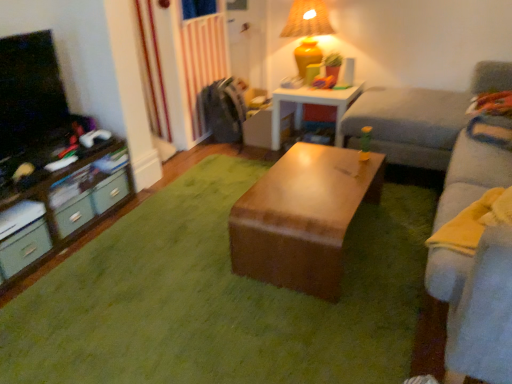
The image size is (512, 384). What are the coordinates of `gray fabric couch at center` in the screenshot? It's located at (420, 118).

Identify the location of matte yellow ceramic table lamp at upper right. The height and width of the screenshot is (384, 512). (307, 31).

Image resolution: width=512 pixels, height=384 pixels. What do you see at coordinates (472, 173) in the screenshot?
I see `light gray fabric couch at right` at bounding box center [472, 173].

You are a GUI agent. You are given a task and a screenshot of the screen. Output one action in this format:
    pyautogui.click(x=<x>, y=<y>)
    Task: Click on the wooden table at center, the second table positioned from the bottom
    This screenshot has height=384, width=512.
    Given the screenshot: What is the action you would take?
    pyautogui.click(x=311, y=103)

From a real-world perspective, which object stands above the other?

matte yellow ceramic table lamp at upper right is physically above.

How different are the orientations of matte gray drawer at lower left, the third drawer in the back-to-front sequence, and matte yellow ceramic table lamp at upper right in degrees?

91.7 degrees separate the facing orientations of matte gray drawer at lower left, the third drawer in the back-to-front sequence, and matte yellow ceramic table lamp at upper right.

Locate an element on the screen. This screenshot has height=384, width=512. drawer that is the 3rd one when counting leftward from the matte yellow ceramic table lamp at upper right is located at coordinates (24, 248).

How many degrees apart are the facing directions of matte gray drawer at lower left, placed as the first drawer when sorted from front to back, and matte black desk at left?

The angular difference between matte gray drawer at lower left, placed as the first drawer when sorted from front to back, and matte black desk at left is 0.000595 degrees.

Based on their sizes in the image, would you say matte gray drawer at lower left, placed as the first drawer when sorted from front to back, is bigger or smaller than matte black desk at left?

matte gray drawer at lower left, placed as the first drawer when sorted from front to back, is smaller than matte black desk at left.

Could you tell me if matte gray drawer at lower left, the third drawer in the back-to-front sequence, is turned towards matte black desk at left?

Yes, matte gray drawer at lower left, the third drawer in the back-to-front sequence, is aimed at matte black desk at left.

Does matte gray drawer at lower left, placed as the first drawer when sorted from front to back, have a greater height compared to matte black desk at left?

No, matte gray drawer at lower left, placed as the first drawer when sorted from front to back, is not taller than matte black desk at left.

Is wooden table at center, the 2th table from the front, situated inside matte gray drawer at lower left, the third drawer in the back-to-front sequence, or outside?

wooden table at center, the 2th table from the front, is located beyond the bounds of matte gray drawer at lower left, the third drawer in the back-to-front sequence.

Considering the relative sizes of wooden table at center, the 2th table from the front, and matte gray drawer at lower left, the third drawer in the back-to-front sequence, in the image provided, is wooden table at center, the 2th table from the front, bigger than matte gray drawer at lower left, the third drawer in the back-to-front sequence,?

Correct, wooden table at center, the 2th table from the front, is larger in size than matte gray drawer at lower left, the third drawer in the back-to-front sequence.

Is wooden table at center, the 2th table from the front, oriented towards matte gray drawer at lower left, the third drawer in the back-to-front sequence?

Yes.

Considering the relative positions of wooden table at center, which ranks as the 1th table in back-to-front order, and matte gray drawer at lower left, placed as the first drawer when sorted from front to back, in the image provided, is wooden table at center, which ranks as the 1th table in back-to-front order, to the right of matte gray drawer at lower left, placed as the first drawer when sorted from front to back, from the viewer's perspective?

Correct, you'll find wooden table at center, which ranks as the 1th table in back-to-front order, to the right of matte gray drawer at lower left, placed as the first drawer when sorted from front to back.

Is green plastic drawer at left, acting as the 1th drawer starting from the back, positioned far away from wooden table at center, the 2th table from the front?

Indeed, green plastic drawer at left, acting as the 1th drawer starting from the back, is not near wooden table at center, the 2th table from the front.

Considering the sizes of objects green plastic drawer at left, which ranks as the third drawer in front-to-back order, and wooden table at center, the 2th table from the front, in the image provided, who is taller, green plastic drawer at left, which ranks as the third drawer in front-to-back order, or wooden table at center, the 2th table from the front,?

Standing taller between the two is wooden table at center, the 2th table from the front.

Considering the relative sizes of green plastic drawer at left, which ranks as the third drawer in front-to-back order, and wooden table at center, which ranks as the 1th table in back-to-front order, in the image provided, is green plastic drawer at left, which ranks as the third drawer in front-to-back order, smaller than wooden table at center, which ranks as the 1th table in back-to-front order,?

Yes.

Does point (110, 191) appear closer or farther from the camera than point (280, 141)?

Point (110, 191) appears to be closer to the viewer than point (280, 141).

Based on their sizes in the image, would you say light gray fabric couch at right is bigger or smaller than green matte drawer at left, which is the 2th drawer from front to back?

light gray fabric couch at right is bigger than green matte drawer at left, which is the 2th drawer from front to back.

Does light gray fabric couch at right turn towards green matte drawer at left, positioned as the second drawer in back-to-front order?

Yes, light gray fabric couch at right is facing green matte drawer at left, positioned as the second drawer in back-to-front order.

Is light gray fabric couch at right directly adjacent to green matte drawer at left, positioned as the second drawer in back-to-front order?

light gray fabric couch at right and green matte drawer at left, positioned as the second drawer in back-to-front order, are clearly separated.

Which point is more forward, (469, 122) or (75, 222)?

The point (75, 222) is more forward.

Between green matte drawer at left, positioned as the second drawer in back-to-front order, and matte yellow ceramic table lamp at upper right, which one has larger width?

matte yellow ceramic table lamp at upper right.

From the image's perspective, is green matte drawer at left, positioned as the second drawer in back-to-front order, above or below matte yellow ceramic table lamp at upper right?

From the image's perspective, green matte drawer at left, positioned as the second drawer in back-to-front order, appears below matte yellow ceramic table lamp at upper right.

Considering the sizes of green matte drawer at left, which is the 2th drawer from front to back, and matte yellow ceramic table lamp at upper right in the image, is green matte drawer at left, which is the 2th drawer from front to back, taller or shorter than matte yellow ceramic table lamp at upper right?

Clearly, green matte drawer at left, which is the 2th drawer from front to back, is shorter compared to matte yellow ceramic table lamp at upper right.

Is green matte drawer at left, positioned as the second drawer in back-to-front order, positioned with its back to matte yellow ceramic table lamp at upper right?

That's not correct — green matte drawer at left, positioned as the second drawer in back-to-front order, is not looking away from matte yellow ceramic table lamp at upper right.

Between matte yellow ceramic table lamp at upper right and wooden table at center, the second table positioned from the bottom, which one has more height?

matte yellow ceramic table lamp at upper right.

Is matte yellow ceramic table lamp at upper right not inside wooden table at center, which ranks as the 1th table in back-to-front order?

Yes.

Does matte yellow ceramic table lamp at upper right have a lesser width compared to wooden table at center, the 2th table from the front?

Correct, the width of matte yellow ceramic table lamp at upper right is less than that of wooden table at center, the 2th table from the front.

From a real-world perspective, is matte yellow ceramic table lamp at upper right positioned under wooden table at center, the 2th table from the front, based on gravity?

No, from a real-world perspective, matte yellow ceramic table lamp at upper right is not beneath wooden table at center, the 2th table from the front.

There is a matte gray drawer at lower left, placed as the first drawer when sorted from front to back. Where is `table lamp above it (from a real-world perspective)`? table lamp above it (from a real-world perspective) is located at coordinates (307, 31).

Where is `desk in front of the matte gray drawer at lower left, placed as the first drawer when sorted from front to back`? desk in front of the matte gray drawer at lower left, placed as the first drawer when sorted from front to back is located at coordinates (67, 208).

Estimate the real-world distances between objects in this image. Which object is further from light gray fabric couch at right, green soft carpet at center or gray fabric couch at center?

Among the two, green soft carpet at center is located further to light gray fabric couch at right.

When comparing their distances from wooden table at center, arranged as the second table when viewed from the back, does matte black desk at left or wooden table at center, the second table positioned from the bottom, seem closer?

Based on the image, wooden table at center, the second table positioned from the bottom, appears to be nearer to wooden table at center, arranged as the second table when viewed from the back.

Estimate the real-world distances between objects in this image. Which object is closer to green plastic drawer at left, which ranks as the third drawer in front-to-back order, matte yellow ceramic table lamp at upper right or wooden table at center, which is the first table from top to bottom?

Among the two, wooden table at center, which is the first table from top to bottom, is located nearer to green plastic drawer at left, which ranks as the third drawer in front-to-back order.

Estimate the real-world distances between objects in this image. Which object is closer to matte yellow ceramic table lamp at upper right, gray fabric couch at center or green matte drawer at left, positioned as the second drawer in back-to-front order?

Among the two, gray fabric couch at center is located nearer to matte yellow ceramic table lamp at upper right.

Looking at the image, which one is located further to green matte drawer at left, which is the 2th drawer from front to back, green soft carpet at center or light gray fabric couch at right?

light gray fabric couch at right lies further to green matte drawer at left, which is the 2th drawer from front to back, than the other object.

From the image, which object appears to be farther from light gray fabric couch at right, matte gray drawer at lower left, the third drawer in the back-to-front sequence, or matte yellow ceramic table lamp at upper right?

The object further to light gray fabric couch at right is matte gray drawer at lower left, the third drawer in the back-to-front sequence.

Based on their spatial positions, is wooden table at center, which is the first table from top to bottom, or green soft carpet at center further from green plastic drawer at left, acting as the 1th drawer starting from the back?

wooden table at center, which is the first table from top to bottom, is positioned further to the anchor green plastic drawer at left, acting as the 1th drawer starting from the back.

Looking at the image, which one is located further to matte black desk at left, gray fabric couch at center or matte gray drawer at lower left, the third drawer in the back-to-front sequence?

Among the two, gray fabric couch at center is located further to matte black desk at left.

Find the location of a particular element. table lamp situated between matte black desk at left and wooden table at center, the 2th table from the front, from left to right is located at coordinates (307, 31).

Find the location of a particular element. This screenshot has width=512, height=384. grass located between light gray fabric couch at right and gray fabric couch at center in the depth direction is located at coordinates (229, 298).

Find the location of a particular element. The width and height of the screenshot is (512, 384). table between light gray fabric couch at right and matte yellow ceramic table lamp at upper right along the z-axis is located at coordinates (302, 218).

At what (x,y) coordinates should I click in order to perform the action: click on grass between green matte drawer at left, which is the 2th drawer from front to back, and light gray fabric couch at right, in the horizontal direction. Please return your answer as a coordinate pair (x, y). Looking at the image, I should click on (229, 298).